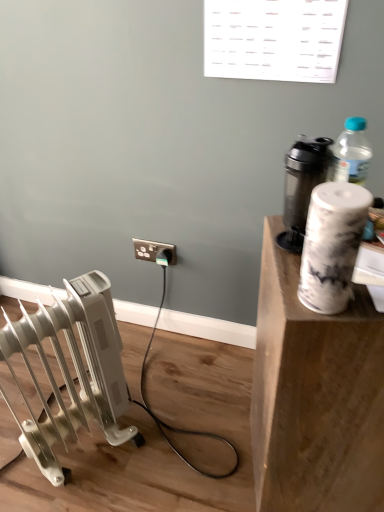
This screenshot has height=512, width=384. What are the coordinates of `vacant space underneath white plastic radiator at lower left (from a real-world perspective)` in the screenshot? It's located at (88, 463).